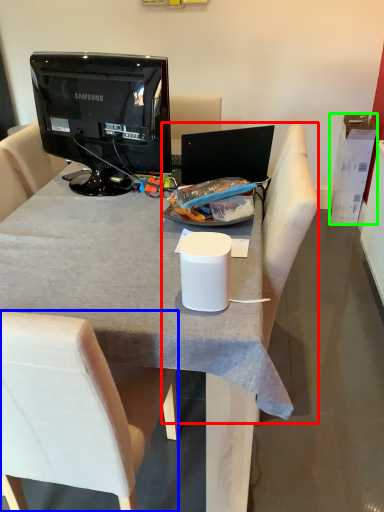
Question: Which object is the farthest from armchair (highlighted by a red box)? Choose among these: chair (highlighted by a blue box) or box (highlighted by a green box).

Choices:
 (A) chair
 (B) box

Answer: (B)